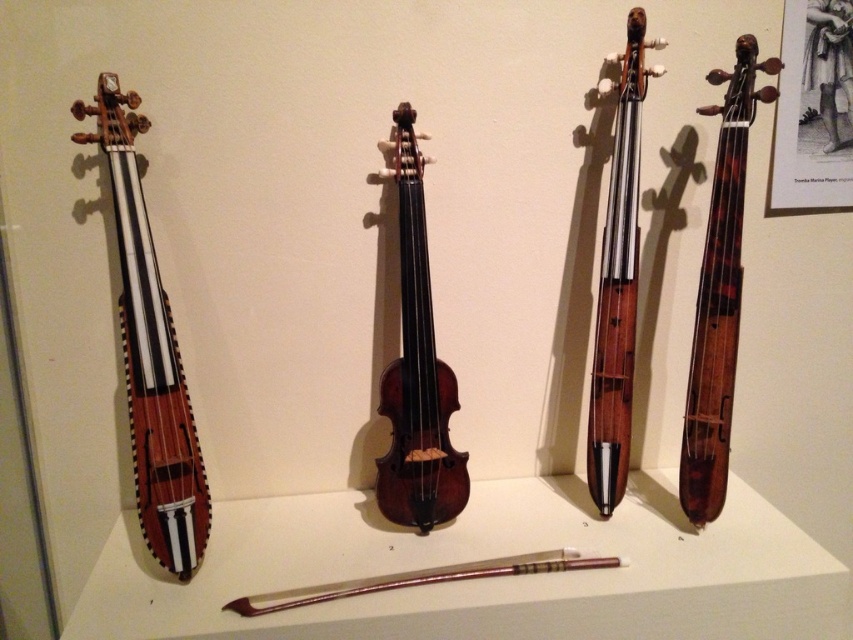
Between wooden violin at right and wooden violin at center, which one is positioned lower?

wooden violin at right is below.

I want to click on wooden violin at right, so click(x=718, y=292).

Which is above, shiny brown violin at center or wooden violin at center?

wooden violin at center is higher up.

Is shiny brown violin at center below wooden violin at center?

Correct, shiny brown violin at center is located below wooden violin at center.

Between point (422, 352) and point (627, 273), which one is positioned in front?

Point (422, 352)

Identify the location of shiny brown violin at center. (416, 369).

Does wooden violin at left have a greater height compared to wooden violin at center?

Incorrect, wooden violin at left's height is not larger of wooden violin at center's.

Is wooden violin at left thinner than wooden violin at center?

Incorrect, wooden violin at left's width is not less than wooden violin at center's.

Who is more forward, (119,145) or (621,147)?

Positioned in front is point (119,145).

This screenshot has width=853, height=640. What are the coordinates of `wooden violin at left` in the screenshot? It's located at (149, 353).